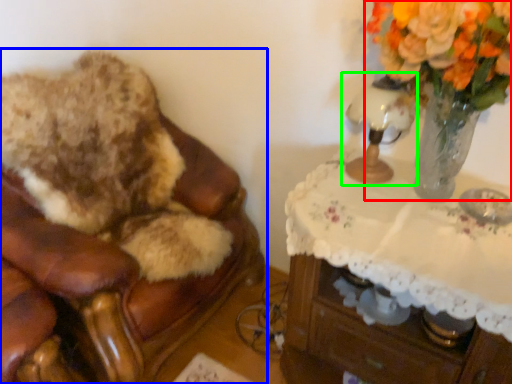
Question: Estimate the real-world distances between objects in this image. Which object is closer to floral arrangement (highlighted by a red box), furniture (highlighted by a blue box) or table lamp (highlighted by a green box)?

Choices:
 (A) furniture
 (B) table lamp

Answer: (B)